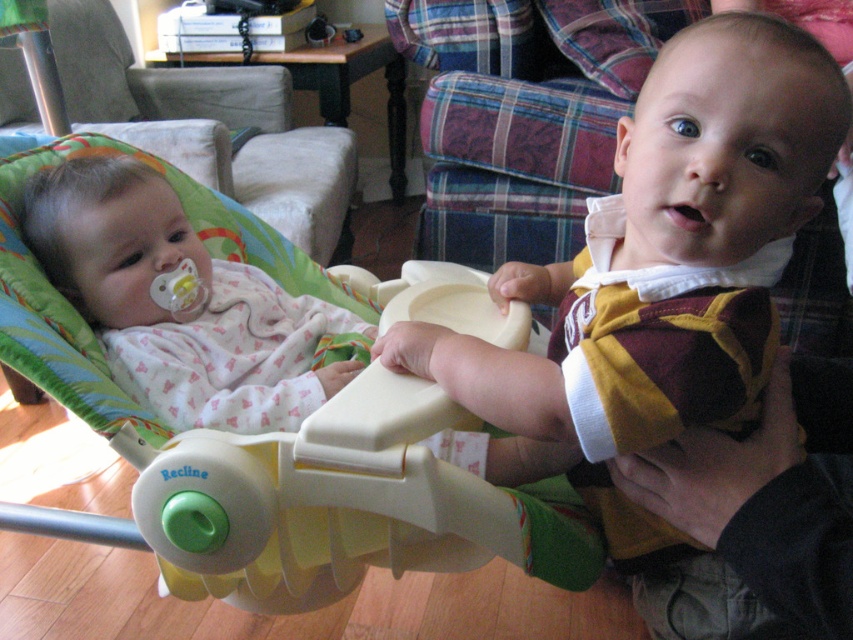
How distant is white plastic baby carriage at left from white soft baby at left?

A distance of 9.96 centimeters exists between white plastic baby carriage at left and white soft baby at left.

How distant is white plastic baby carriage at left from white soft baby at left?

They are 9.96 centimeters apart.

Identify the location of white plastic baby carriage at left. The width and height of the screenshot is (853, 640). (381, 529).

Between point (741, 403) and point (386, 504), which one is positioned in front?

Positioned in front is point (741, 403).

Locate an element on the screen. The width and height of the screenshot is (853, 640). maroon felt baby at center is located at coordinates 601,378.

I want to click on maroon felt baby at center, so click(x=601, y=378).

Consider the image. Is maroon felt baby at center above white soft baby at left?

Actually, maroon felt baby at center is below white soft baby at left.

The width and height of the screenshot is (853, 640). What are the coordinates of `maroon felt baby at center` in the screenshot? It's located at (601, 378).

Find the location of `maroon felt baby at center`. maroon felt baby at center is located at coordinates (601, 378).